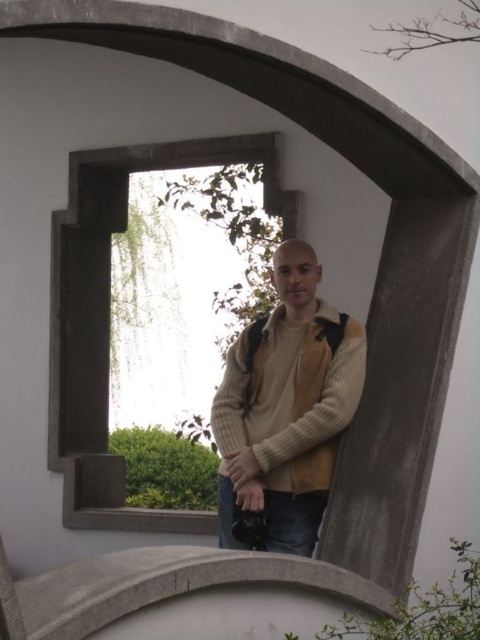
Is stone window frame at center above knit sweater at center?

Indeed, stone window frame at center is positioned over knit sweater at center.

In the scene shown: Between stone window frame at center and knit sweater at center, which one is positioned lower?

knit sweater at center is below.

Between point (91, 406) and point (320, 337), which one is positioned in front?

Positioned in front is point (320, 337).

Locate an element on the screen. stone window frame at center is located at coordinates (108, 317).